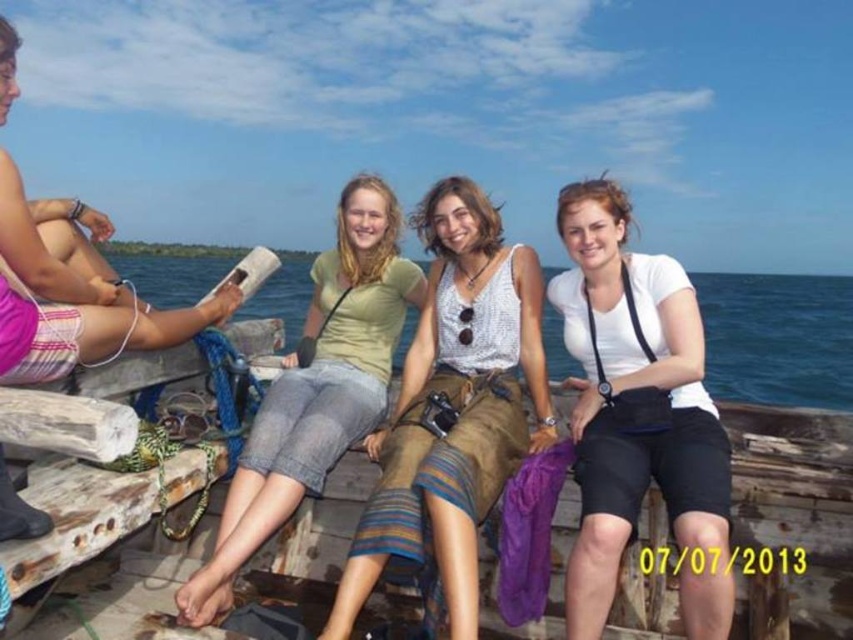
Question: Is light green fabric skirt at center positioned before blue water at center?

Choices:
 (A) no
 (B) yes

Answer: (B)

Question: Based on their relative distances, which object is farther from the white matte shorts at right?

Choices:
 (A) blue water at center
 (B) pink woven shorts at left
 (C) light green fabric skirt at center

Answer: (A)

Question: Is light green fabric skirt at center smaller than blue water at center?

Choices:
 (A) no
 (B) yes

Answer: (B)

Question: Which object appears farthest from the camera in this image?

Choices:
 (A) denim shorts at center
 (B) blue water at center
 (C) pink woven shorts at left

Answer: (B)

Question: Is white matte shorts at right smaller than denim shorts at center?

Choices:
 (A) yes
 (B) no

Answer: (A)

Question: Which object is farther from the camera taking this photo?

Choices:
 (A) blue water at center
 (B) pink woven shorts at left
 (C) light green fabric skirt at center
 (D) denim shorts at center

Answer: (A)